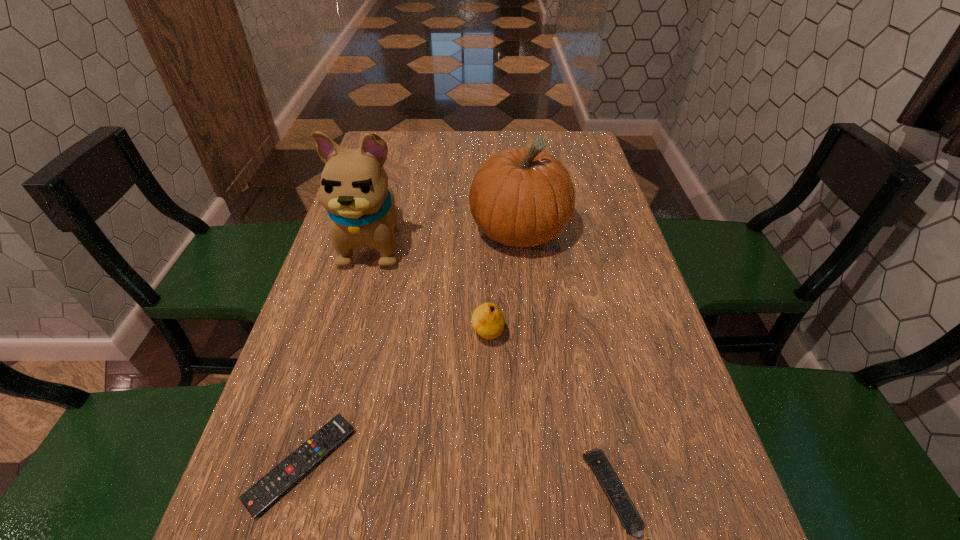
Locate an element on the screen. This screenshot has width=960, height=540. vacant space at the far left corner of the desktop is located at coordinates (390, 159).

The image size is (960, 540). In order to click on free space at the far right corner of the desktop in this screenshot , I will do `click(568, 161)`.

I want to click on free spot between the third farthest object and the left remote control, so click(x=395, y=400).

The height and width of the screenshot is (540, 960). Find the location of `free space between the taller remote control and the second tallest object`. free space between the taller remote control and the second tallest object is located at coordinates (565, 362).

I want to click on free space between the second tallest object and the tallest object, so click(446, 237).

This screenshot has width=960, height=540. In order to click on empty location between the shortest object and the tallest object in this screenshot , I will do `click(338, 353)`.

Where is `free space between the second tallest object and the right remote control`? The height and width of the screenshot is (540, 960). free space between the second tallest object and the right remote control is located at coordinates (565, 362).

This screenshot has height=540, width=960. In order to click on vacant area that lies between the tallest object and the shortest object in this screenshot , I will do `click(338, 353)`.

Locate an element on the screen. The height and width of the screenshot is (540, 960). free space between the pear and the right remote control is located at coordinates (549, 413).

Image resolution: width=960 pixels, height=540 pixels. I want to click on vacant space that is in between the pumpkin and the shorter remote control, so click(411, 348).